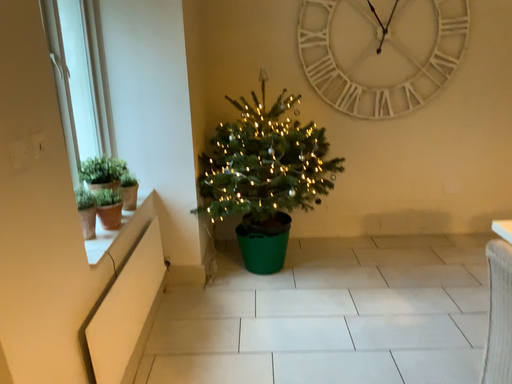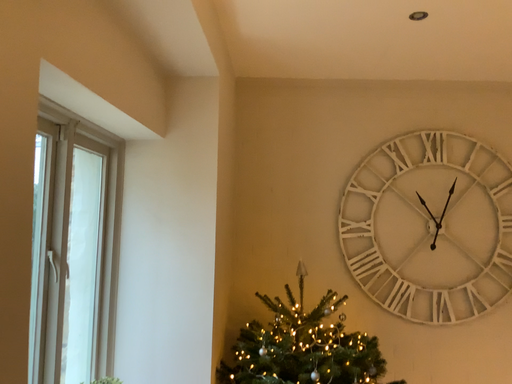
Question: Which way did the camera rotate in the video?

Choices:
 (A) rotated upward
 (B) rotated downward

Answer: (A)